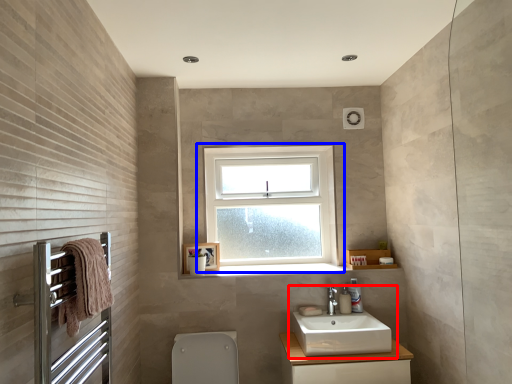
Question: Which object appears farthest to the camera in this image, sink (highlighted by a red box) or window (highlighted by a blue box)?

Choices:
 (A) sink
 (B) window

Answer: (B)